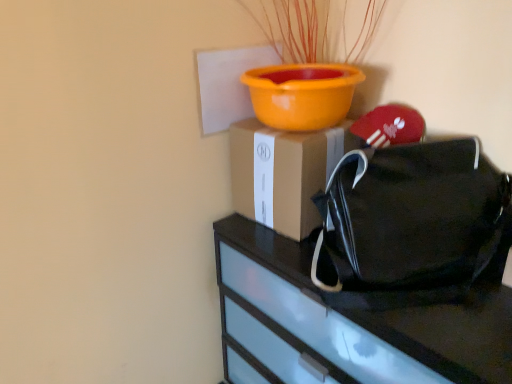
The image size is (512, 384). I want to click on brown cardboard box at center, so click(284, 173).

Where is `black matte bag at right`? This screenshot has width=512, height=384. black matte bag at right is located at coordinates (344, 324).

What is the approximate height of black matte bag at right?

33.77 inches.

At what (x,y) coordinates should I click in order to perform the action: click on brown cardboard box at center. Please return your answer as a coordinate pair (x, y). Looking at the image, I should click on (284, 173).

Is black matte bag at right bigger or smaller than black fabric handbag at right?

black matte bag at right is bigger than black fabric handbag at right.

Considering the sizes of objects black matte bag at right and black fabric handbag at right in the image provided, who is thinner, black matte bag at right or black fabric handbag at right?

Thinner between the two is black fabric handbag at right.

Is black matte bag at right in front of black fabric handbag at right?

Yes, the depth of black matte bag at right is less than that of black fabric handbag at right.

Which is more to the left, black matte bag at right or black fabric handbag at right?

black matte bag at right.

Can you confirm if brown cardboard box at center is thinner than black fabric handbag at right?

No, brown cardboard box at center is not thinner than black fabric handbag at right.

The image size is (512, 384). What are the coordinates of `cardboard box behind the black fabric handbag at right` in the screenshot? It's located at (284, 173).

From a real-world perspective, is brown cardboard box at center physically below black fabric handbag at right?

Yes, from a real-world perspective, brown cardboard box at center is beneath black fabric handbag at right.

From the image's perspective, is brown cardboard box at center located beneath black fabric handbag at right?

→ No, from the image's perspective, brown cardboard box at center is not below black fabric handbag at right.

Which object is positioned more to the right, brown cardboard box at center or black matte bag at right?

black matte bag at right.

The width and height of the screenshot is (512, 384). I want to click on cardboard box that appears behind the black matte bag at right, so click(284, 173).

Consider the image. Who is shorter, brown cardboard box at center or black matte bag at right?

brown cardboard box at center is shorter.

In the scene shown: How different are the orientations of black fabric handbag at right and brown cardboard box at center in degrees?

The angular difference between black fabric handbag at right and brown cardboard box at center is 65.3 degrees.

Can you confirm if black fabric handbag at right is taller than brown cardboard box at center?

→ Yes, black fabric handbag at right is taller than brown cardboard box at center.

Is black fabric handbag at right oriented towards brown cardboard box at center?

No.

From a real-world perspective, does black fabric handbag at right sit lower than brown cardboard box at center?

No, from a real-world perspective, black fabric handbag at right is not below brown cardboard box at center.

Between black matte bag at right and brown cardboard box at center, which one appears on the right side from the viewer's perspective?

black matte bag at right.

Considering the sizes of objects black matte bag at right and brown cardboard box at center in the image provided, who is bigger, black matte bag at right or brown cardboard box at center?

black matte bag at right.

Is black matte bag at right facing towards brown cardboard box at center?

No, black matte bag at right is not facing towards brown cardboard box at center.

From a real-world perspective, is black matte bag at right positioned above or below brown cardboard box at center?

Clearly, from a real-world perspective, black matte bag at right is below brown cardboard box at center.

From a real-world perspective, who is located higher, black fabric handbag at right or black matte bag at right?

From a 3D spatial view, black fabric handbag at right is above.

How distant is black fabric handbag at right from black matte bag at right?

They are 6.73 inches apart.

Is point (437, 220) in front of point (384, 360)?

No, it is behind (384, 360).

Where is `furniture located below the black fabric handbag at right (from the image's perspective)`? Image resolution: width=512 pixels, height=384 pixels. furniture located below the black fabric handbag at right (from the image's perspective) is located at coordinates (344, 324).

I want to click on handbag above the brown cardboard box at center (from a real-world perspective), so click(409, 225).

Looking at the image, which one is located further to black fabric handbag at right, brown cardboard box at center or black matte bag at right?

Based on the image, brown cardboard box at center appears to be further to black fabric handbag at right.

Which object lies further to the anchor point black matte bag at right, black fabric handbag at right or brown cardboard box at center?

Based on the image, brown cardboard box at center appears to be further to black matte bag at right.

Based on their spatial positions, is brown cardboard box at center or black fabric handbag at right further from black matte bag at right?

Among the two, brown cardboard box at center is located further to black matte bag at right.

Which object lies further to the anchor point brown cardboard box at center, black fabric handbag at right or black matte bag at right?

Among the two, black matte bag at right is located further to brown cardboard box at center.

From the picture: When comparing their distances from brown cardboard box at center, does black matte bag at right or black fabric handbag at right seem further?

black matte bag at right is further to brown cardboard box at center.

Based on the photo, when comparing their distances from black fabric handbag at right, does black matte bag at right or brown cardboard box at center seem further?

Based on the image, brown cardboard box at center appears to be further to black fabric handbag at right.

You are a GUI agent. You are given a task and a screenshot of the screen. Output one action in this format:
    pyautogui.click(x=<x>, y=<y>)
    Task: Click on the handbag between brown cardboard box at center and black matte bag at right from top to bottom
    The image size is (512, 384).
    Given the screenshot: What is the action you would take?
    pyautogui.click(x=409, y=225)